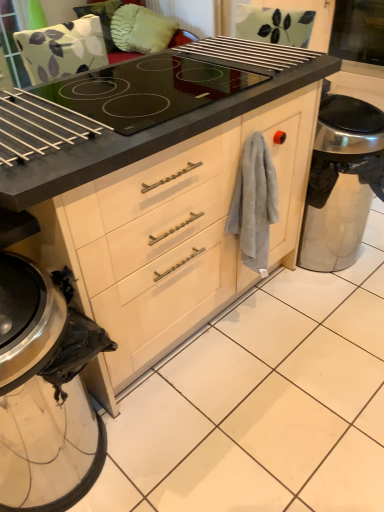
Question: Is transparent glass screen door at upper right further to camera compared to metallic silver trash can at lower left?

Choices:
 (A) yes
 (B) no

Answer: (A)

Question: Is transparent glass screen door at upper right outside of metallic silver trash can at lower left?

Choices:
 (A) yes
 (B) no

Answer: (A)

Question: Is there a large distance between transparent glass screen door at upper right and metallic silver trash can at lower left?

Choices:
 (A) no
 (B) yes

Answer: (B)

Question: Does transparent glass screen door at upper right have a greater height compared to metallic silver trash can at lower left?

Choices:
 (A) no
 (B) yes

Answer: (A)

Question: Is transparent glass screen door at upper right next to metallic silver trash can at lower left and touching it?

Choices:
 (A) no
 (B) yes

Answer: (A)

Question: Is transparent glass screen door at upper right thinner than metallic silver trash can at lower left?

Choices:
 (A) yes
 (B) no

Answer: (B)

Question: Can you confirm if transparent glass screen door at upper right is shorter than satin silver trash can at lower right?

Choices:
 (A) yes
 (B) no

Answer: (A)

Question: Is transparent glass screen door at upper right at the right side of satin silver trash can at lower right?

Choices:
 (A) no
 (B) yes

Answer: (B)

Question: From the image's perspective, is transparent glass screen door at upper right under satin silver trash can at lower right?

Choices:
 (A) yes
 (B) no

Answer: (B)

Question: Is satin silver trash can at lower right inside transparent glass screen door at upper right?

Choices:
 (A) yes
 (B) no

Answer: (B)

Question: From the image's perspective, is transparent glass screen door at upper right located above satin silver trash can at lower right?

Choices:
 (A) no
 (B) yes

Answer: (B)

Question: Can you confirm if transparent glass screen door at upper right is taller than satin silver trash can at lower right?

Choices:
 (A) yes
 (B) no

Answer: (B)

Question: From a real-world perspective, is satin silver trash can at lower right over gray cotton towel at right?

Choices:
 (A) yes
 (B) no

Answer: (B)